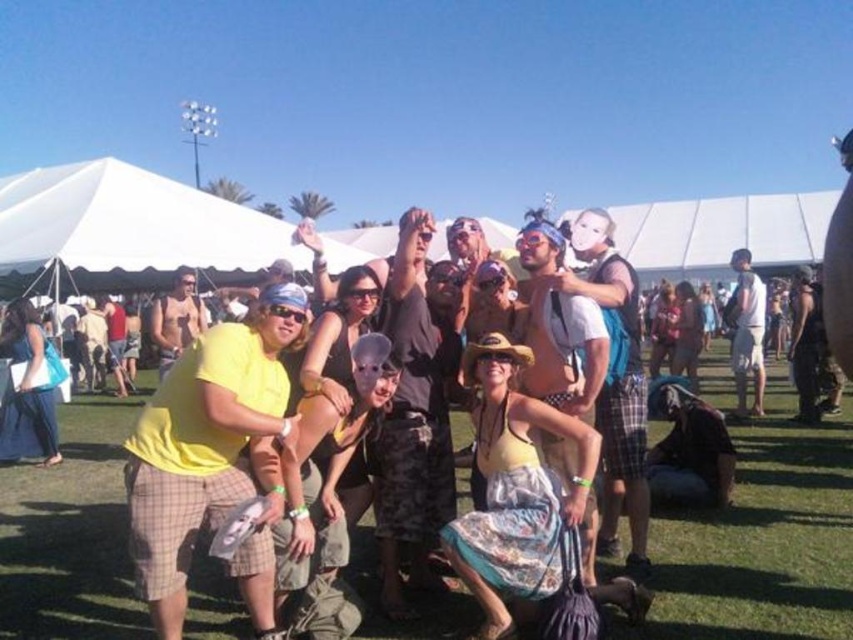
Question: Which point is farther from the camera taking this photo?

Choices:
 (A) (12, 403)
 (B) (795, 460)

Answer: (A)

Question: Can you confirm if green grass at center is thinner than yellow t-shirt at center?

Choices:
 (A) yes
 (B) no

Answer: (B)

Question: Considering the relative positions of green grass at center and yellow t-shirt at center in the image provided, where is green grass at center located with respect to yellow t-shirt at center?

Choices:
 (A) left
 (B) right

Answer: (B)

Question: Does green grass at center have a greater width compared to yellow t-shirt at center?

Choices:
 (A) no
 (B) yes

Answer: (B)